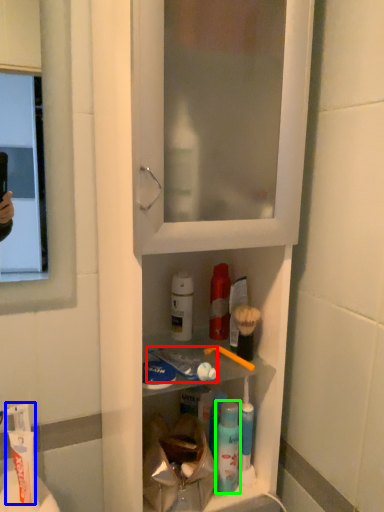
Question: Which object is positioned farthest from toothpaste (highlighted by a red box)? Select from toothpaste (highlighted by a blue box) and mouthwash (highlighted by a green box).

Choices:
 (A) toothpaste
 (B) mouthwash

Answer: (A)